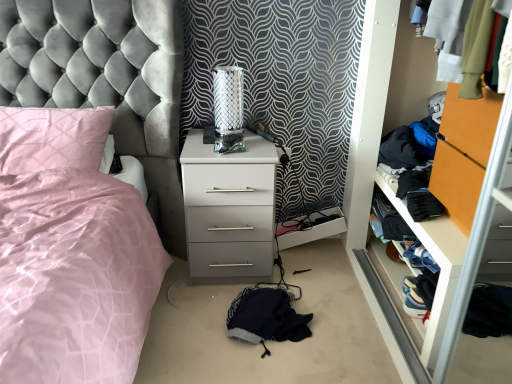
Locate an element on the screen. The image size is (512, 384). free space on the front side of white glossy chest of drawers at center is located at coordinates (193, 320).